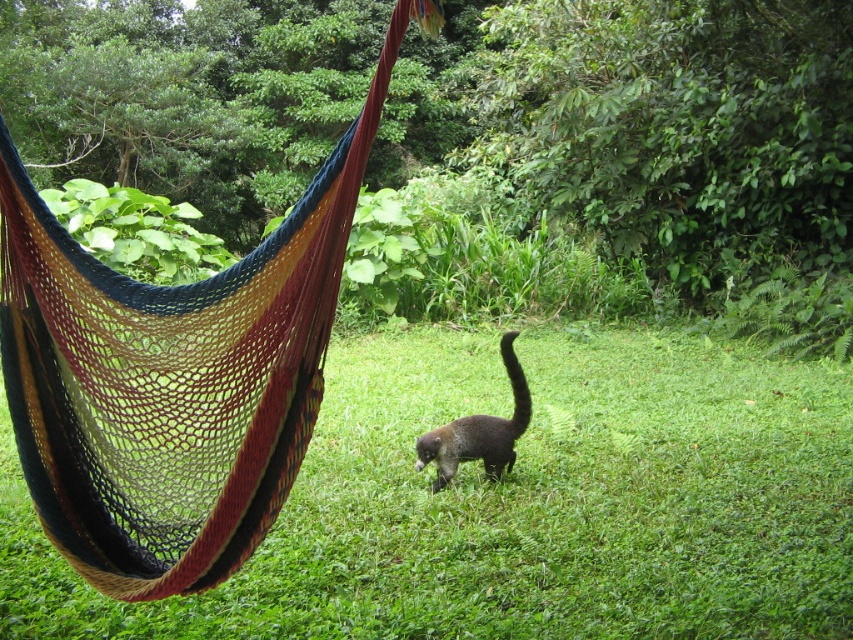
Question: Can you confirm if green grass at center is positioned below brown fuzzy tail at center?

Choices:
 (A) no
 (B) yes

Answer: (B)

Question: Where is green grass at center located in relation to brown furry cat at center in the image?

Choices:
 (A) below
 (B) above

Answer: (A)

Question: Among these points, which one is nearest to the camera?

Choices:
 (A) (467, 451)
 (B) (80, 595)

Answer: (B)

Question: Which point appears farthest from the camera in this image?

Choices:
 (A) (519, 400)
 (B) (747, 513)
 (C) (196, 477)

Answer: (A)

Question: Can you confirm if green grass at center is positioned to the left of brown furry cat at center?

Choices:
 (A) no
 (B) yes

Answer: (A)

Question: Considering the real-world distances, which object is closest to the green grass at center?

Choices:
 (A) brown fuzzy tail at center
 (B) multicolored woven hammock at center
 (C) brown furry cat at center

Answer: (C)